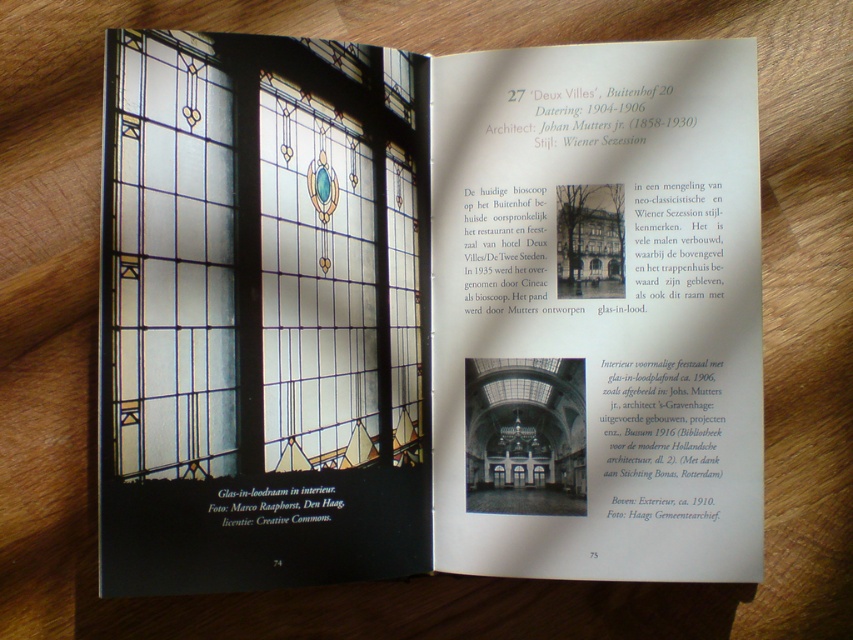
You are holding a camera and want to take a photo of the stained glass window at upper left. The camera requires the subject to be at least 24 inches away to focus properly. Is the current distance sufficient?

The stained glass window at upper left is only 23.43 inches away from the camera, which is less than the required 24 inches. Therefore, the current distance is insufficient for proper focusing.

You are an architect analyzing the book layout. The stained glass window at upper left and the clear stained glass at center are both depicted on the left page. Which of these two has a larger vertical dimension?

The stained glass window at upper left has a greater height compared to the clear stained glass at center, so it has a larger vertical dimension.

You are an art student analyzing the open book. The book has the stained glass window at upper left and the clear stained glass at center. Which object on the page is wider?

The stained glass window at upper left is wider than the clear stained glass at center.